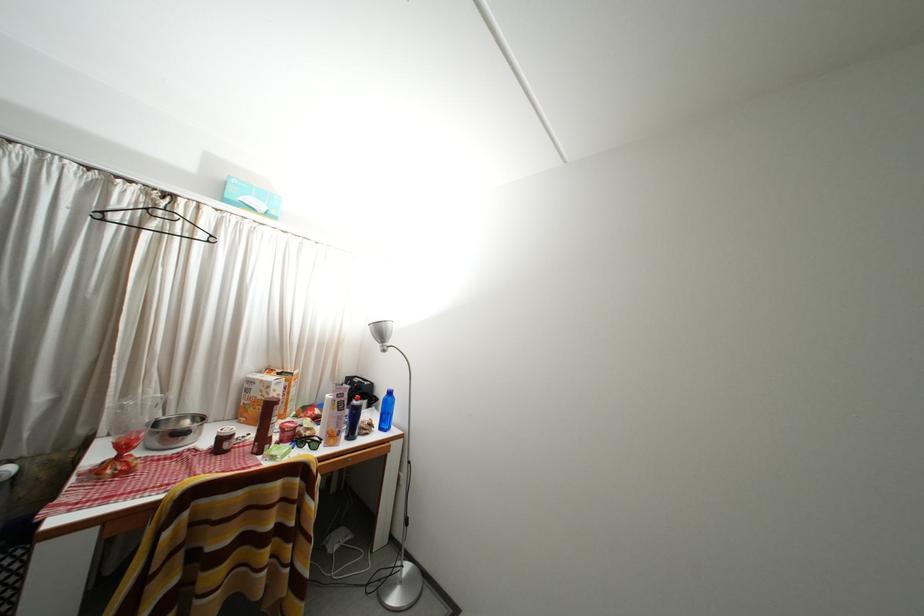
You are a GUI agent. You are given a task and a screenshot of the screen. Output one action in this format:
    pyautogui.click(x=<x>, y=<y>)
    Task: Click on the light blue box
    The height and width of the screenshot is (616, 924).
    Given the screenshot: What is the action you would take?
    pyautogui.click(x=251, y=198)